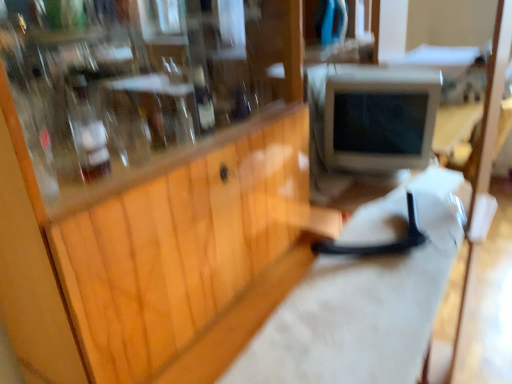
The image size is (512, 384). In order to click on vacant region above white matte workbench at center (from a real-world perspective) in this screenshot , I will do `click(372, 291)`.